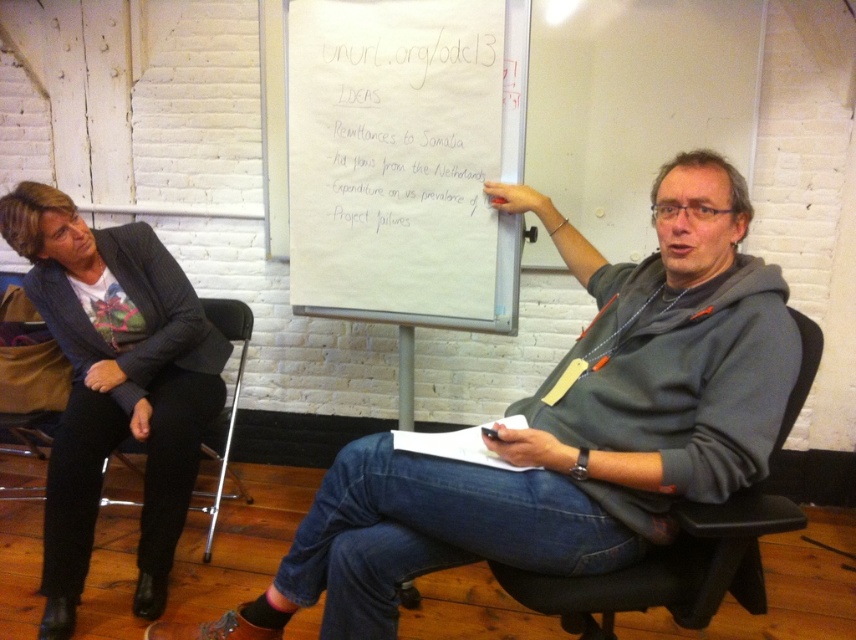
Who is more distant from viewer, (405, 451) or (177, 356)?

The point (177, 356) is more distant.

Between gray hoodie at center and dark gray blazer at left, which one is positioned lower?

gray hoodie at center is lower down.

Is point (551, 506) positioned before point (122, 326)?

Yes, point (551, 506) is closer to viewer.

At what (x,y) coordinates should I click in order to perform the action: click on gray hoodie at center. Please return your answer as a coordinate pair (x, y). This screenshot has width=856, height=640. Looking at the image, I should click on (568, 428).

Which is more to the right, whiteboard at center or black leather chair at center?

black leather chair at center

This screenshot has width=856, height=640. What do you see at coordinates (403, 160) in the screenshot? I see `whiteboard at center` at bounding box center [403, 160].

Locate an element on the screen. whiteboard at center is located at coordinates point(403,160).

Can you confirm if gray hoodie at center is smaller than black leather chair at center?

Actually, gray hoodie at center might be larger than black leather chair at center.

Between gray hoodie at center and black leather chair at center, which one has less height?

black leather chair at center

Does point (716, 237) come behind point (712, 563)?

Yes.

The image size is (856, 640). Identify the location of gray hoodie at center. (568, 428).